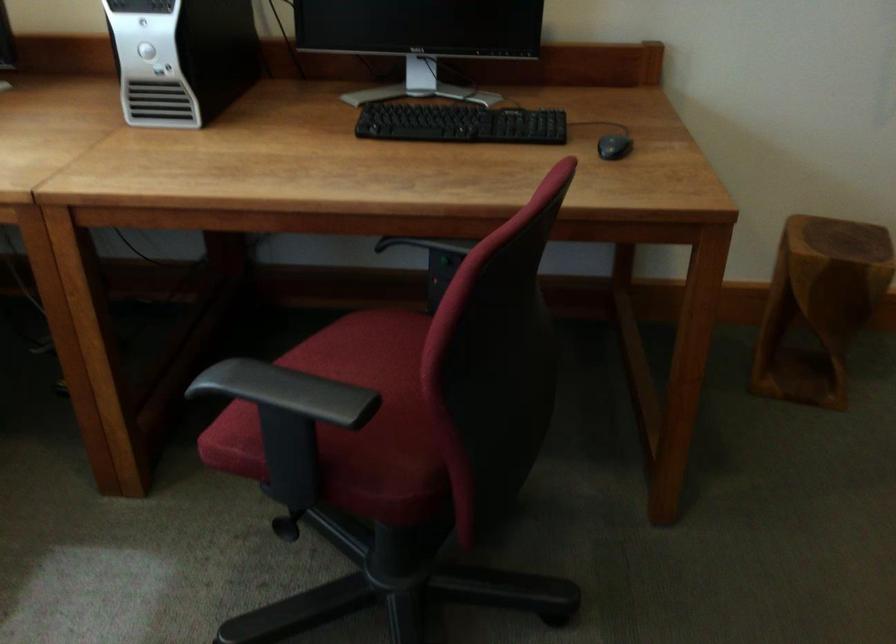
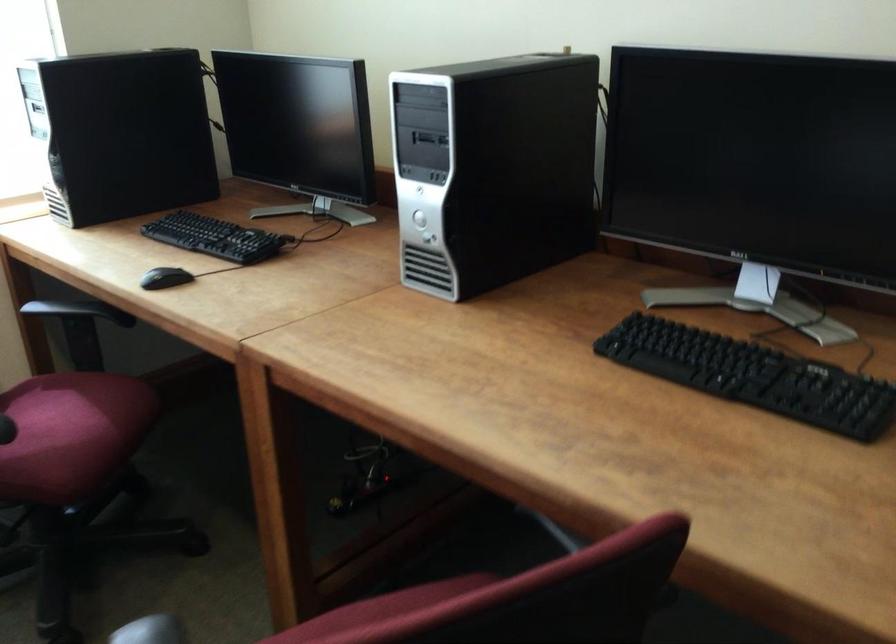
The point at (x=476, y=122) is marked in the first image. Where is the corresponding point in the second image?

(753, 375)